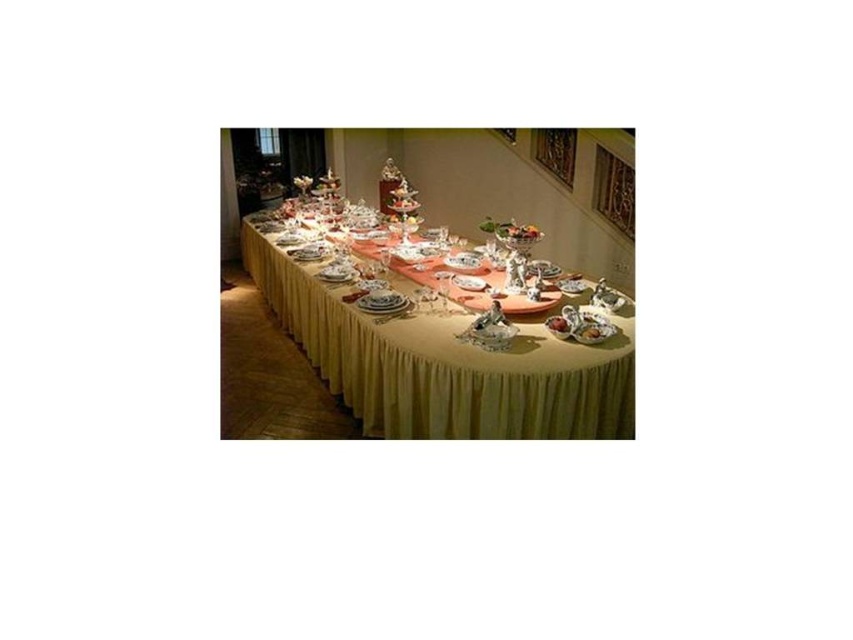
Does shiny silver bowl at lower right have a lesser width compared to smooth pink cake at center?

No, shiny silver bowl at lower right is not thinner than smooth pink cake at center.

Which of these two, shiny silver bowl at lower right or smooth pink cake at center, stands taller?

smooth pink cake at center

This screenshot has width=853, height=640. I want to click on shiny silver bowl at lower right, so click(592, 332).

This screenshot has height=640, width=853. Describe the element at coordinates (444, 365) in the screenshot. I see `yellow fabric tablecloth at center` at that location.

Is yellow fabric tablecloth at center in front of smooth pink cake at center?

Yes, it is in front of smooth pink cake at center.

Is point (618, 424) farther from viewer compared to point (567, 323)?

No, (618, 424) is closer to viewer.

You are a GUI agent. You are given a task and a screenshot of the screen. Output one action in this format:
    pyautogui.click(x=<x>, y=<y>)
    Task: Click on the yellow fabric tablecloth at center
    The image size is (853, 640).
    Given the screenshot: What is the action you would take?
    pyautogui.click(x=444, y=365)

Can you confirm if white porcelain plate at center is taller than shiny silver bowl at lower right?

Correct, white porcelain plate at center is much taller as shiny silver bowl at lower right.

What do you see at coordinates (381, 300) in the screenshot? I see `white porcelain plate at center` at bounding box center [381, 300].

Between point (389, 305) and point (602, 337), which one is positioned behind?

Point (389, 305)

Locate an element on the screen. white porcelain plate at center is located at coordinates (381, 300).